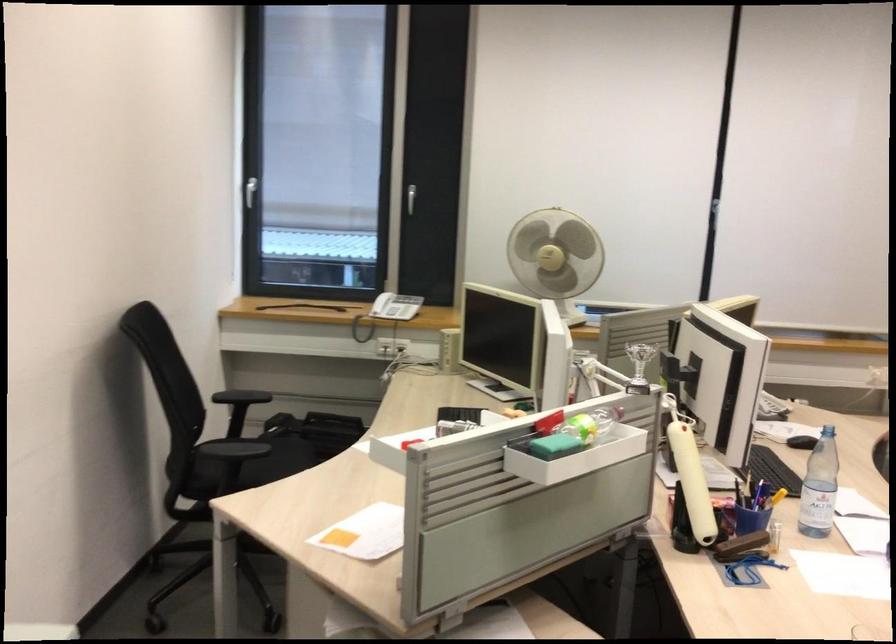
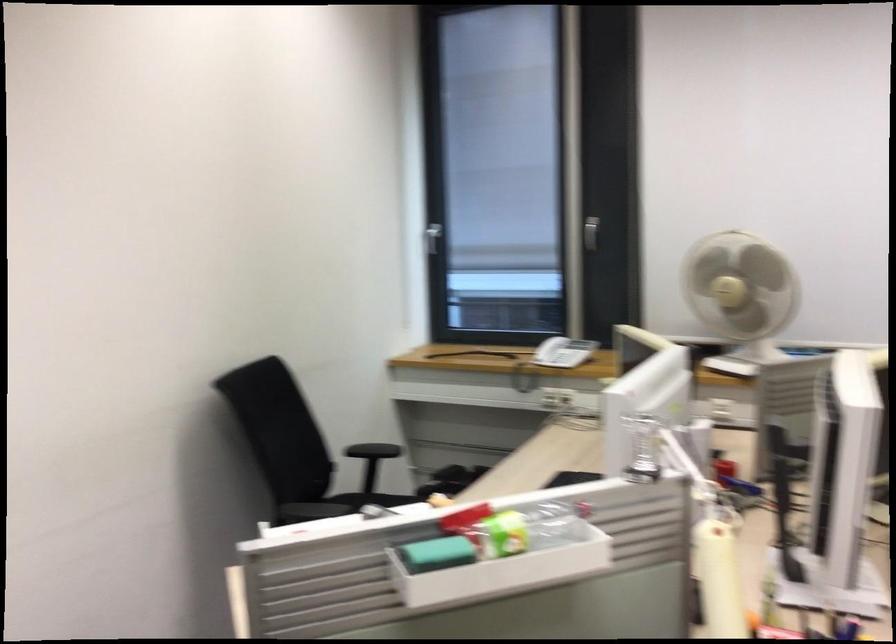
Find the pixel in the second image that matches pixel 247 196 in the first image.

(433, 238)